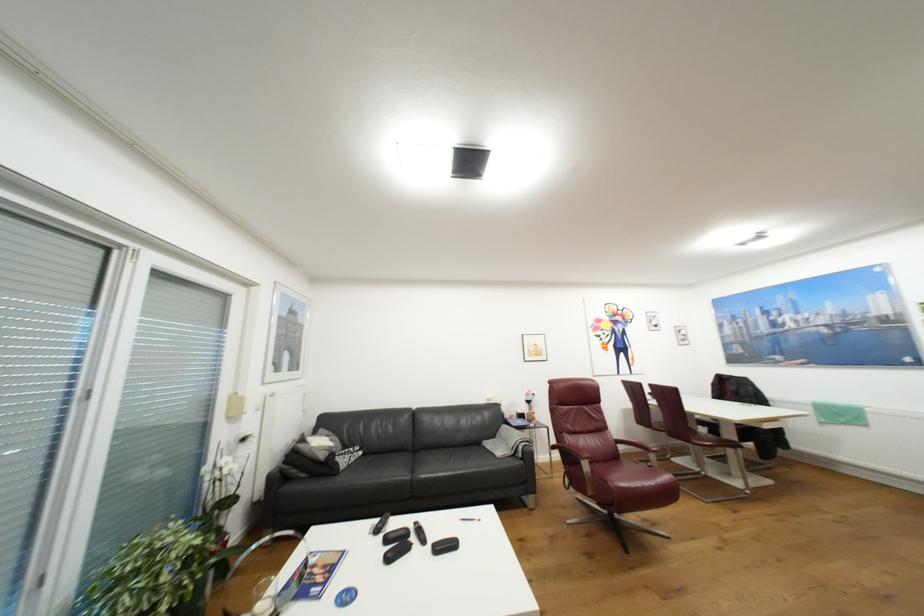
The width and height of the screenshot is (924, 616). Identify the location of blue circular lid. (345, 597).